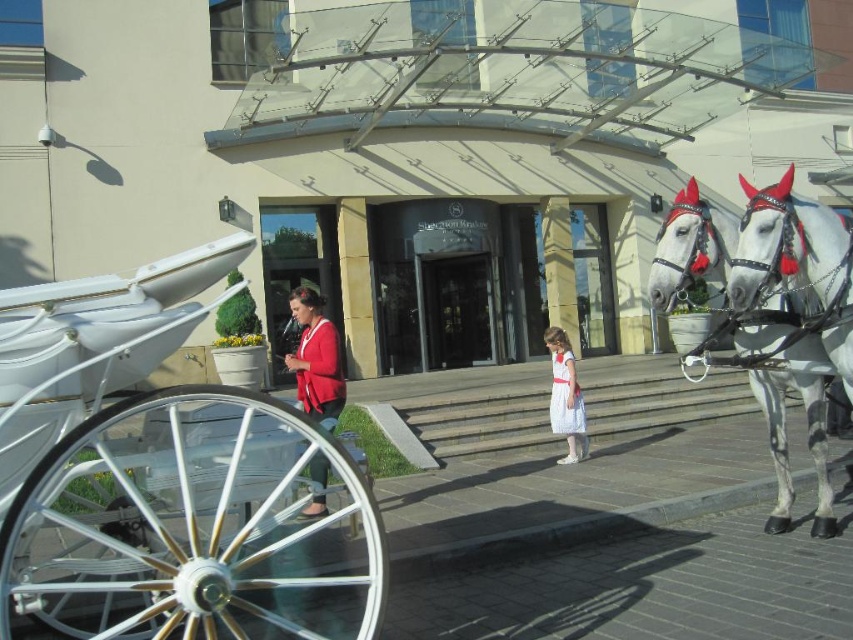
Is white polished wood horse cart at left to the right of matte red cardigan at center from the viewer's perspective?

No, white polished wood horse cart at left is not to the right of matte red cardigan at center.

At what (x,y) coordinates should I click in order to perform the action: click on white polished wood horse cart at left. Please return your answer as a coordinate pair (x, y). Looking at the image, I should click on (165, 477).

Where is `white polished wood horse cart at left`? This screenshot has width=853, height=640. white polished wood horse cart at left is located at coordinates (165, 477).

Between white speckled horse at right and white satin dress at center, which one appears on the right side from the viewer's perspective?

white speckled horse at right is more to the right.

I want to click on white speckled horse at right, so click(807, 428).

Locate an element on the screen. The image size is (853, 640). white speckled horse at right is located at coordinates (807, 428).

From the picture: Which is more to the left, white glossy horse at right or matte red cardigan at center?

matte red cardigan at center

Describe the element at coordinates (796, 259) in the screenshot. I see `white glossy horse at right` at that location.

Identify the location of white glossy horse at right. The image size is (853, 640). (796, 259).